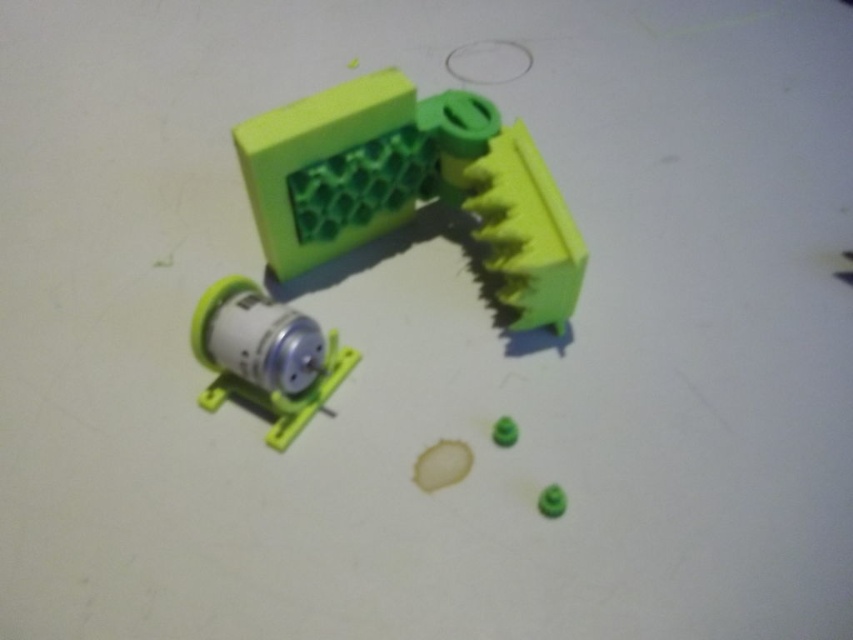
Between point (268, 308) and point (555, 515), which one is positioned behind?

The point (268, 308) is behind.

Is metallic silver motor at lower left taller than green matte ball at lower right?

Yes, metallic silver motor at lower left is taller than green matte ball at lower right.

Is point (262, 333) positioned after point (554, 504)?

Yes, point (262, 333) is behind point (554, 504).

Identify the location of metallic silver motor at lower left. (x=265, y=355).

Can you confirm if green matte plastic brush at upper center is positioned to the left of green matte plastic toy at center?

Yes, green matte plastic brush at upper center is to the left of green matte plastic toy at center.

Is point (434, 124) positioned before point (503, 435)?

That is False.

Find the location of a particular element. This screenshot has height=640, width=853. green matte plastic brush at upper center is located at coordinates (409, 184).

Is green matte plastic brush at upper center further to the viewer compared to green matte ball at lower right?

Yes, it is behind green matte ball at lower right.

Does green matte plastic brush at upper center have a smaller size compared to green matte ball at lower right?

Actually, green matte plastic brush at upper center might be larger than green matte ball at lower right.

Where is `green matte plastic brush at upper center`? Image resolution: width=853 pixels, height=640 pixels. green matte plastic brush at upper center is located at coordinates (409, 184).